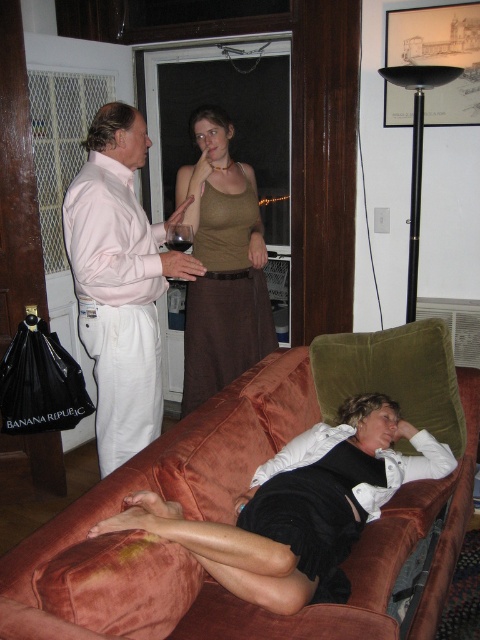
Can you confirm if white cotton pants at left is smaller than matte green tank top at upper center?

Yes, white cotton pants at left is smaller than matte green tank top at upper center.

This screenshot has height=640, width=480. What do you see at coordinates (120, 282) in the screenshot?
I see `white cotton pants at left` at bounding box center [120, 282].

Which is behind, point (87, 298) or point (215, 241)?

The point (215, 241) is behind.

The width and height of the screenshot is (480, 640). I want to click on white cotton pants at left, so click(x=120, y=282).

Does velvet brown couch at lower center appear on the right side of white cotton pants at left?

Yes, velvet brown couch at lower center is to the right of white cotton pants at left.

Can you confirm if velvet brown couch at lower center is thinner than white cotton pants at left?

No, velvet brown couch at lower center is not thinner than white cotton pants at left.

Who is more forward, (175, 632) or (133, 152)?

Point (175, 632) is more forward.

This screenshot has width=480, height=640. What are the coordinates of `velvet brown couch at lower center` in the screenshot? It's located at (226, 522).

Is velvet brown couch at lower center further to camera compared to matte green tank top at upper center?

No, it is not.

Does velvet brown couch at lower center have a lesser height compared to matte green tank top at upper center?

Yes, velvet brown couch at lower center is shorter than matte green tank top at upper center.

At what (x,y) coordinates should I click in order to perform the action: click on velvet brown couch at lower center. Please return your answer as a coordinate pair (x, y). This screenshot has width=480, height=640. Looking at the image, I should click on (226, 522).

Where is `velvet brown couch at lower center`? The image size is (480, 640). velvet brown couch at lower center is located at coordinates (226, 522).